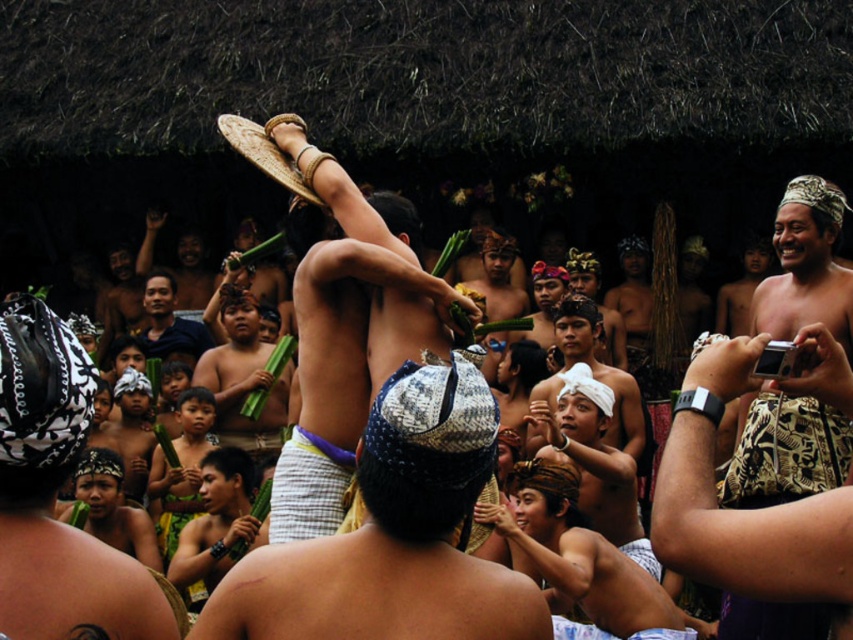
Question: Is white woven cloth at lower center closer to the viewer compared to smooth green bamboo at center?

Choices:
 (A) yes
 (B) no

Answer: (A)

Question: Which of the following is the farthest from the observer?

Choices:
 (A) (38, 499)
 (B) (421, 484)

Answer: (B)

Question: Which point appears closest to the camera in this image?

Choices:
 (A) (238, 353)
 (B) (572, 321)

Answer: (B)

Question: Which of the following is the farthest from the observer?

Choices:
 (A) white woven cloth at center
 (B) matte black shirt at center
 (C) blue woven cloth at center

Answer: (B)

Question: Can you confirm if blue woven cloth at center is positioned to the left of matte black shirt at center?

Choices:
 (A) yes
 (B) no

Answer: (B)

Question: Is matte woven mat at center wider than matte black shirt at center?

Choices:
 (A) yes
 (B) no

Answer: (A)